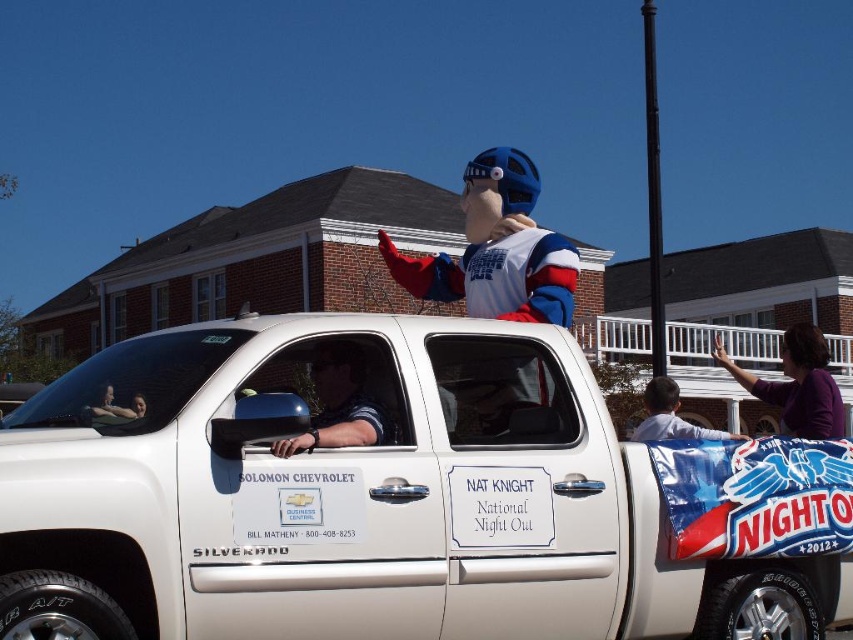
You are a photographer at the event and want to capture both the white matte truck at center and the polished dark blue shirt at center in a single frame. Given their sizes, which object should you focus on to ensure both are clearly visible in the photo?

The white matte truck at center is larger than the polished dark blue shirt at center, so focusing on the truck will help ensure both are clearly visible in the photo.